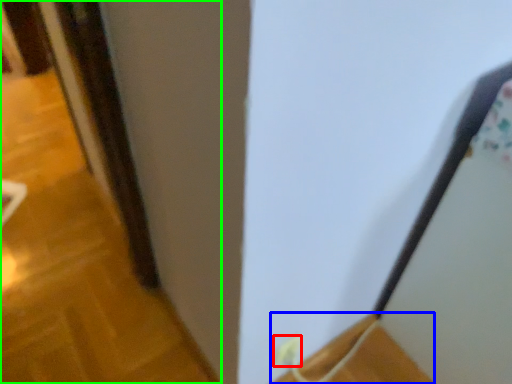
Question: Estimate the real-world distances between objects in this image. Which object is closer to electric outlet (highlighted by a red box), wood (highlighted by a blue box) or door (highlighted by a green box)?

Choices:
 (A) wood
 (B) door

Answer: (A)